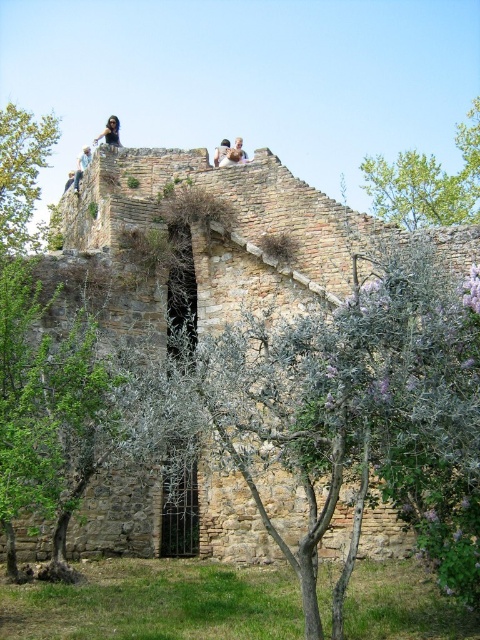
Question: Does blonde hair person at upper center appear over dark brown hair at upper center?

Choices:
 (A) yes
 (B) no

Answer: (A)

Question: Is green leafy tree at upper right further to the viewer compared to dark brown leather jacket at upper center?

Choices:
 (A) yes
 (B) no

Answer: (A)

Question: Estimate the real-world distances between objects in this image. Which object is farther from the green leafy tree at upper right?

Choices:
 (A) dark brown leather jacket at upper center
 (B) light brown hair at upper center

Answer: (A)

Question: Is dark brown leather jacket at upper center above dark brown hair at upper center?

Choices:
 (A) yes
 (B) no

Answer: (A)

Question: Which point appears farthest from the camera in this image?

Choices:
 (A) (28, 132)
 (B) (422, 260)
 (C) (80, 179)
 (D) (216, 164)

Answer: (A)

Question: Which object is closer to the camera taking this photo?

Choices:
 (A) dark hair at upper center
 (B) light brown hair at upper center
 (C) dark brown leather jacket at upper center

Answer: (B)